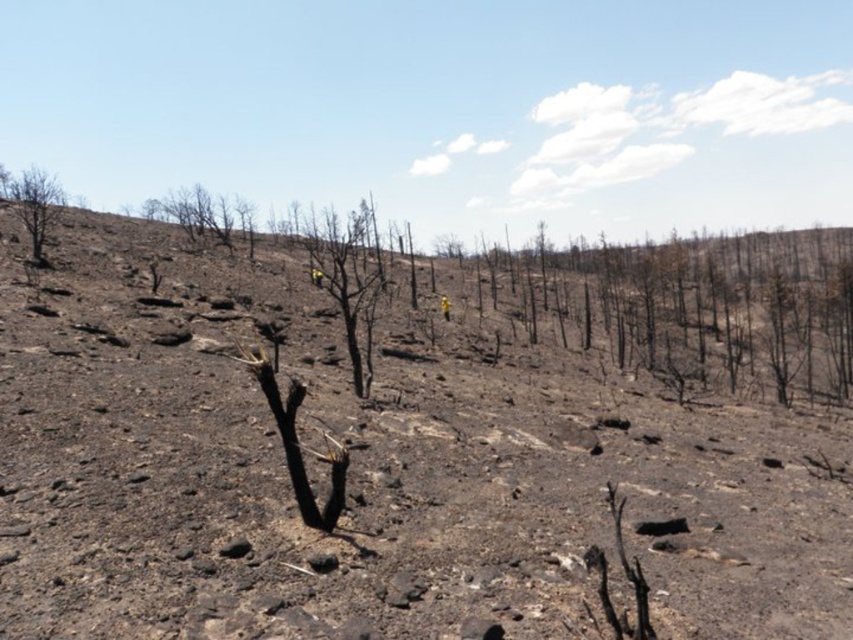
You are a firefighter assessing the scene. You notice the charcoal ash hillside at center and the charcoal bark tree at center. From your vantage point, which object is positioned to the right of the other?

The charcoal ash hillside at center is to the right of the charcoal bark tree at center.

You are a firefighter assessing the scene. You need to approach the charcoal bark tree at center to check for hotspots. Considering your equipment has a maximum reach of 20 meters, will you need to move closer to the tree?

The charcoal bark tree at center is 24.14 meters away from the camera. Since your equipment has a maximum reach of 20 meters, you will need to move closer to the tree to effectively check for hotspots.

You are a photographer standing in the middle of the desolate landscape. You want to take a photo that includes both the point at coordinates point [146,204] and point [19,211]. Which point should you focus on first to ensure both are in sharp focus?

You should focus on point [19,211] first because it is closer to the camera than point [146,204]. By focusing on the closer point, the farther point will also be within the depth of field, ensuring both are in sharp focus.